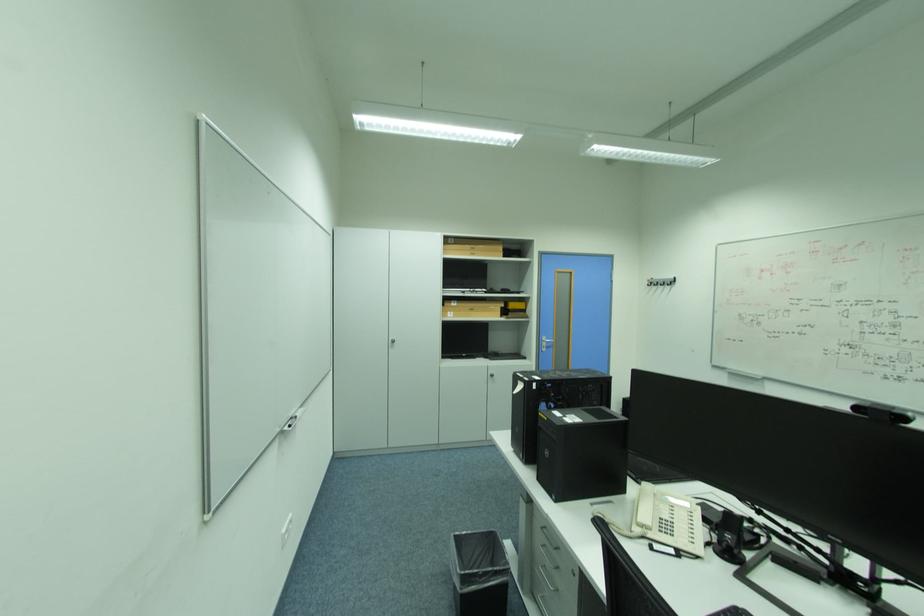
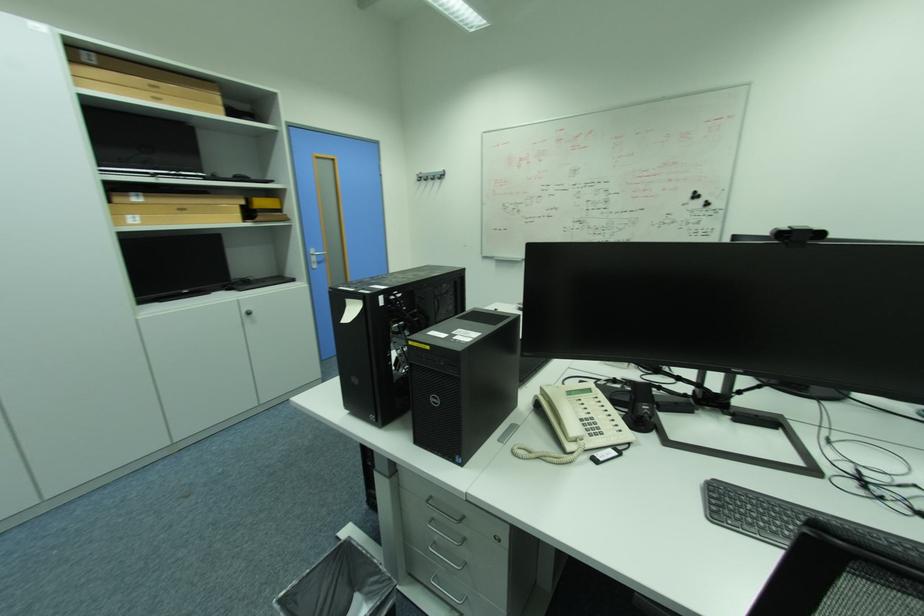
The point at (552,345) is marked in the first image. Where is the corresponding point in the second image?

(321, 260)